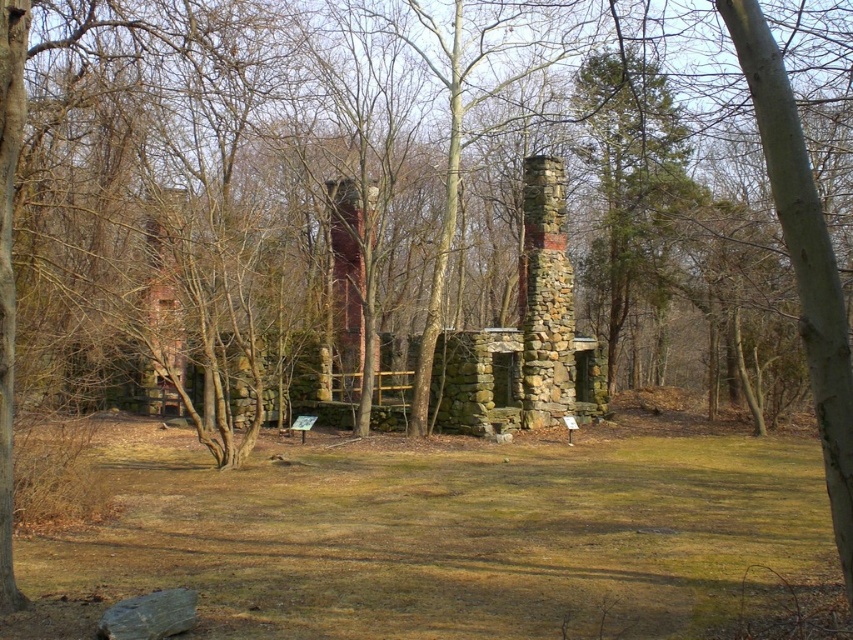
Question: Can you confirm if green grass at center is positioned to the right of red brick chimney at center?

Choices:
 (A) no
 (B) yes

Answer: (B)

Question: Which is nearer to the green grass at center?

Choices:
 (A) stone chimney at center
 (B) red brick chimney at center

Answer: (A)

Question: Can you confirm if stone chimney at center is thinner than red brick chimney at center?

Choices:
 (A) no
 (B) yes

Answer: (B)

Question: Among these objects, which one is farthest from the camera?

Choices:
 (A) red brick chimney at center
 (B) stone chimney at center

Answer: (A)

Question: Considering the relative positions of green grass at center and red brick chimney at center in the image provided, where is green grass at center located with respect to red brick chimney at center?

Choices:
 (A) left
 (B) right

Answer: (B)

Question: Estimate the real-world distances between objects in this image. Which object is closer to the green grass at center?

Choices:
 (A) stone chimney at center
 (B) red brick chimney at center

Answer: (A)